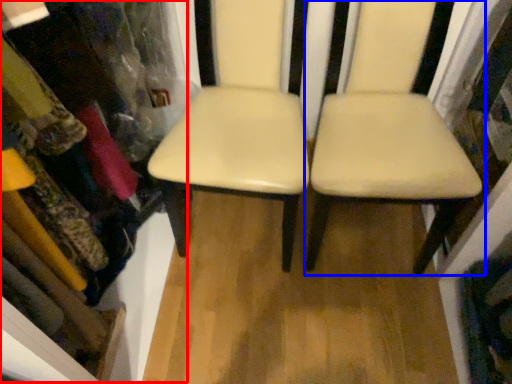
Question: Which object is further to the camera taking this photo, bookshelf (highlighted by a red box) or chair (highlighted by a blue box)?

Choices:
 (A) bookshelf
 (B) chair

Answer: (B)